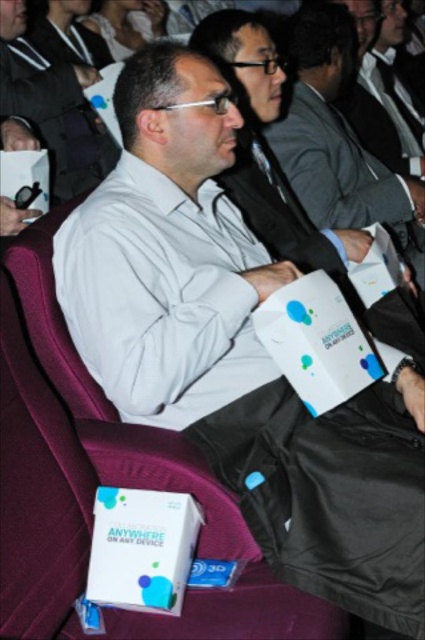
Question: Which of the following is the farthest from the observer?

Choices:
 (A) (90, 148)
 (B) (397, 216)
 (C) (40, 22)

Answer: (C)

Question: Is dark gray suit at center thinner than dark gray fabric business suit at upper left?

Choices:
 (A) no
 (B) yes

Answer: (A)

Question: Which point is farther to the camera?

Choices:
 (A) matte white box at center
 (B) dark gray fabric business suit at upper left

Answer: (B)

Question: Estimate the real-world distances between objects in this image. Which object is farther from the dark gray fabric business suit at upper left?

Choices:
 (A) dark gray suit at center
 (B) matte white box at center

Answer: (A)

Question: Is matte white box at center further to camera compared to dark gray fabric business suit at upper left?

Choices:
 (A) no
 (B) yes

Answer: (A)

Question: Can you confirm if matte white box at center is wider than dark gray fabric business suit at upper left?

Choices:
 (A) no
 (B) yes

Answer: (B)